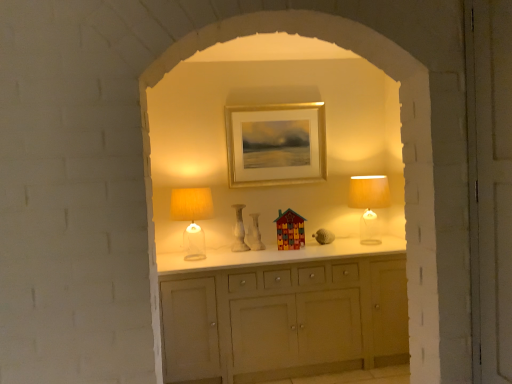
The width and height of the screenshot is (512, 384). Find the location of `free point above gold metallic picture frame at center (from a real-world perspective)`. free point above gold metallic picture frame at center (from a real-world perspective) is located at coordinates (275, 107).